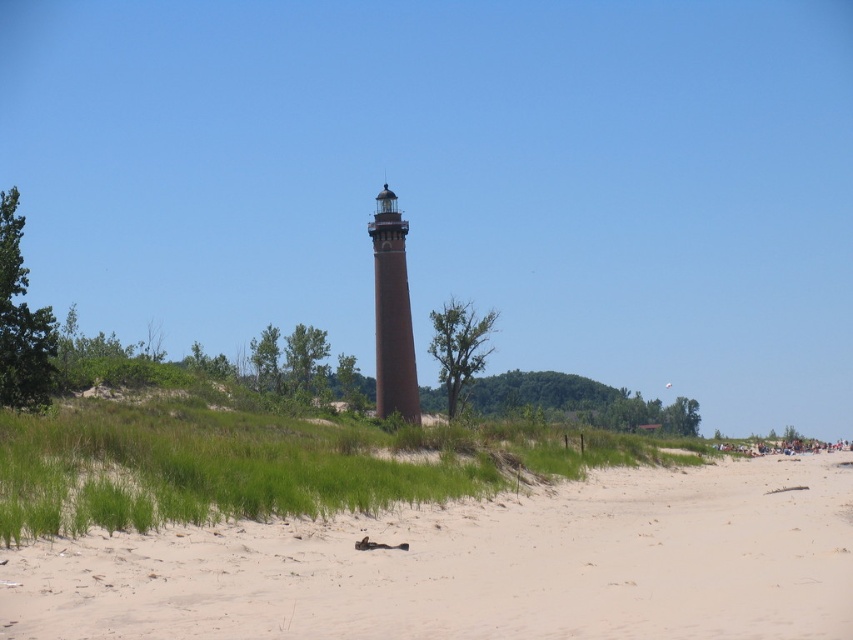
You are a photographer planning to capture the brown matte tower at center and the sandy beach at center in a single shot. Based on their positions, which object should you focus on first to ensure both are in frame?

The sandy beach at center is below the brown matte tower at center, so you should focus on the brown matte tower at center first to ensure both are in frame.